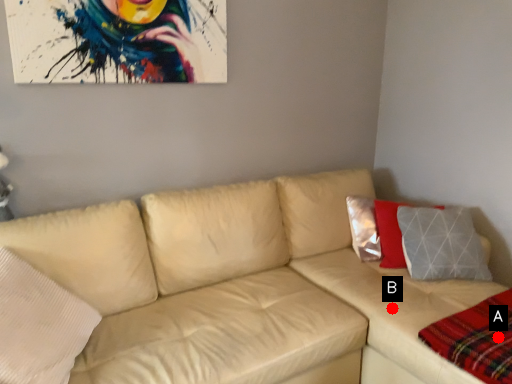
Question: Two points are circled on the image, labeled by A and B beside each circle. Which point is farther to the camera?

Choices:
 (A) A is further
 (B) B is further

Answer: (B)